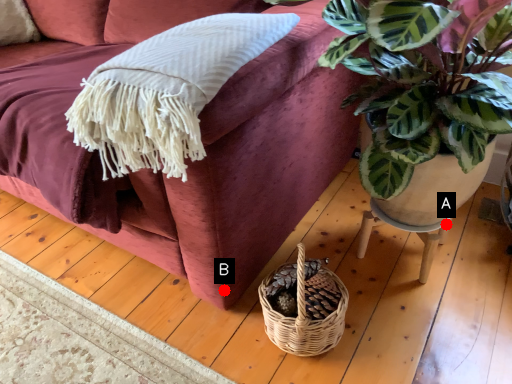
Question: Two points are circled on the image, labeled by A and B beside each circle. Among these points, which one is farthest from the camera?

Choices:
 (A) A is further
 (B) B is further

Answer: (A)